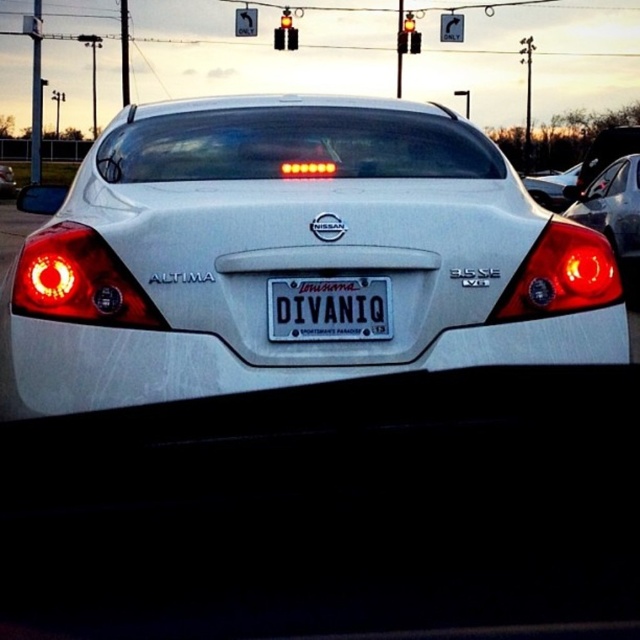
You are a pedestrian standing behind the satin black sedan at center. You want to check if the matte plastic brake light at center is visible from your position. Based on their positions, can you see it?

The matte plastic brake light at center is positioned under the satin black sedan at center, so it is likely obstructed by the sedan and not visible from behind.

Looking at this image, you are standing 2 meters away from the matte plastic brake light at right. Can you safely step forward to touch it without overstepping the pedestrian crosswalk line?

The matte plastic brake light at right and viewer are 2.10 meters apart from each other. Since you are standing 2 meters away, you can step forward 0.10 meters to reach it without crossing the crosswalk line.